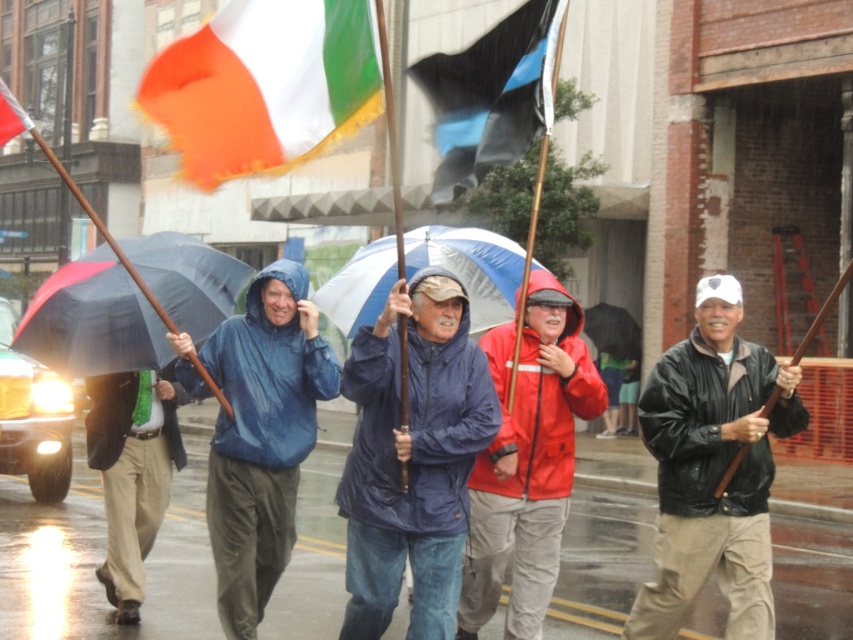
Does khaki cotton pants at center have a lesser height compared to white and green fabric flag at upper left?

In fact, khaki cotton pants at center may be taller than white and green fabric flag at upper left.

Between khaki cotton pants at center and white and green fabric flag at upper left, which one has less height?

white and green fabric flag at upper left is shorter.

Which is behind, point (123, 620) or point (13, 131)?

Point (123, 620)

I want to click on khaki cotton pants at center, so click(132, 472).

Which of these two, orange fabric flag at upper left or blue/white striped umbrella at center, stands taller?

orange fabric flag at upper left

Can you confirm if orange fabric flag at upper left is positioned to the left of blue/white striped umbrella at center?

Yes, orange fabric flag at upper left is to the left of blue/white striped umbrella at center.

What do you see at coordinates (265, 86) in the screenshot? This screenshot has width=853, height=640. I see `orange fabric flag at upper left` at bounding box center [265, 86].

Identify the location of orange fabric flag at upper left. (265, 86).

Does point (561, 476) come farther from viewer compared to point (601, 305)?

That is False.

Is red matte jacket at center shorter than black matte umbrella at center?

Incorrect, red matte jacket at center's height does not fall short of black matte umbrella at center's.

Identify the location of red matte jacket at center. The height and width of the screenshot is (640, 853). (527, 461).